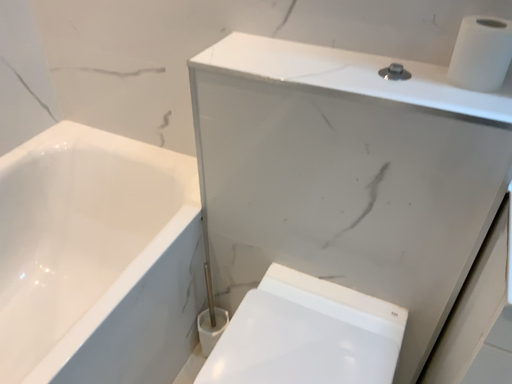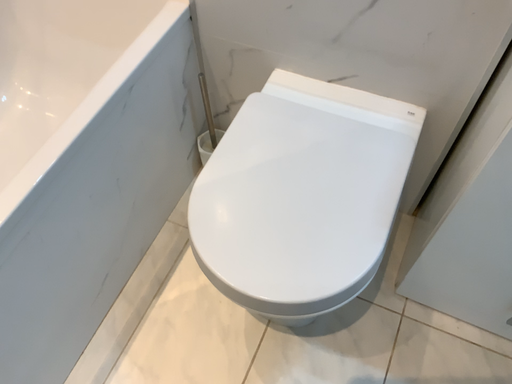
Question: Which way did the camera rotate in the video?

Choices:
 (A) rotated downward
 (B) rotated upward

Answer: (A)